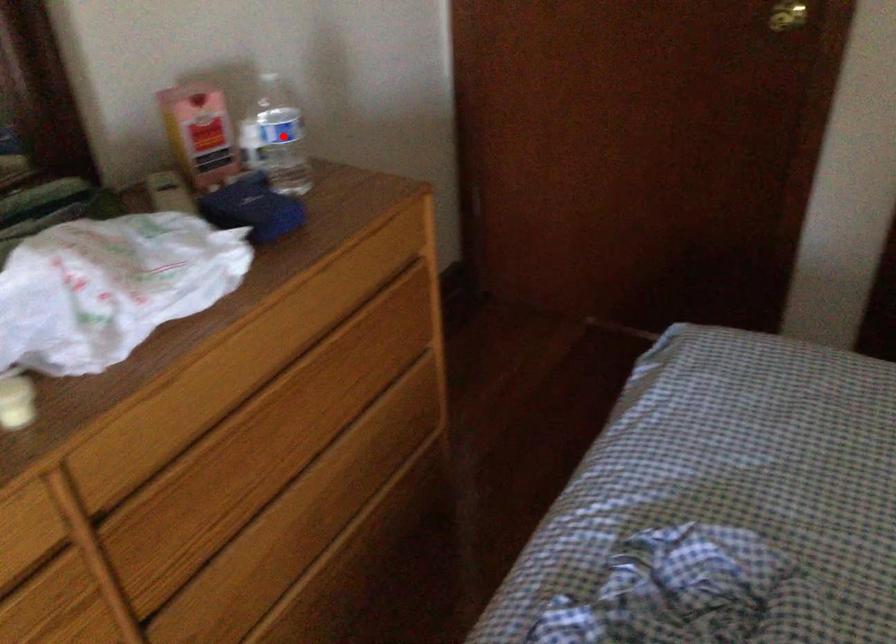
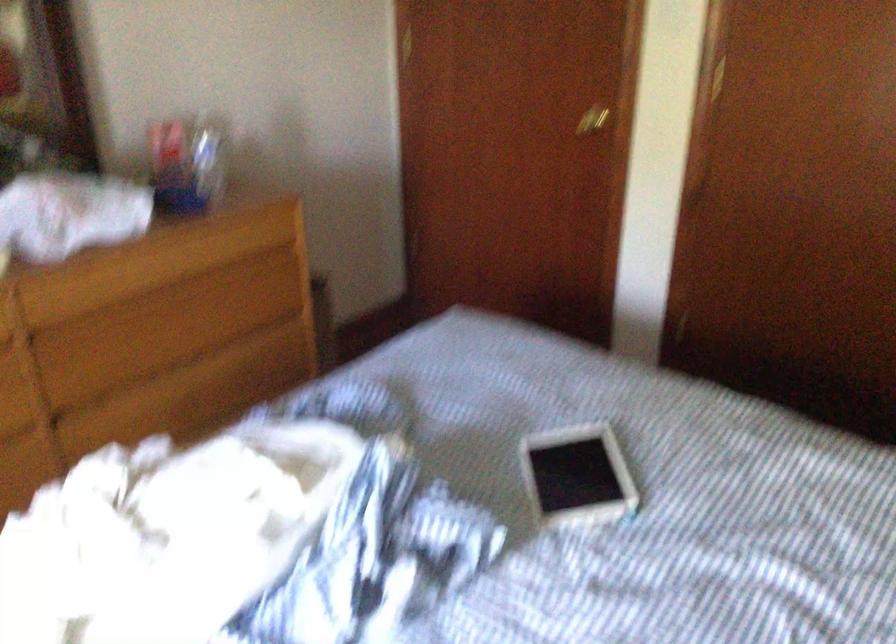
Find the pixel in the second image that matches the highlighted location in the first image.

(208, 156)